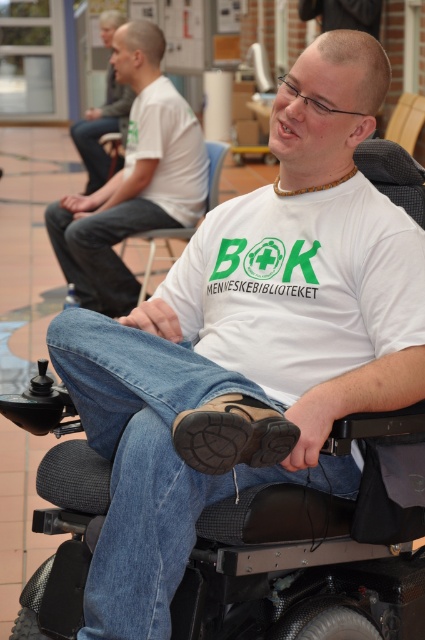
Consider the image. You are a person in a wheelchair trying to navigate through a public space. There is a black rubber mobility scooter at lower center represented by point (299, 568). Can you safely pass around it without obstruction?

The black rubber mobility scooter at lower center is represented by point (299, 568), so yes, you can safely pass around it as long as there is enough space to maneuver your wheelchair around the scooter.

You are a person with mobility needs trying to navigate through the space. There is a black rubber mobility scooter at lower center and a light brown leather jacket at upper left. Which object is smaller in size?

The black rubber mobility scooter at lower center is smaller in size compared to the light brown leather jacket at upper left according to the description.

You are a person in a wheelchair trying to reach the exit located at the top of the image. There is a black rubber mobility scooter at lower center in your path. Can you safely navigate around it?

The black rubber mobility scooter at lower center is positioned at coordinates (299, 568). Since the scooter is at lower center, you can safely navigate around it by moving either to the left or right side of the scooter to reach the exit at the top.